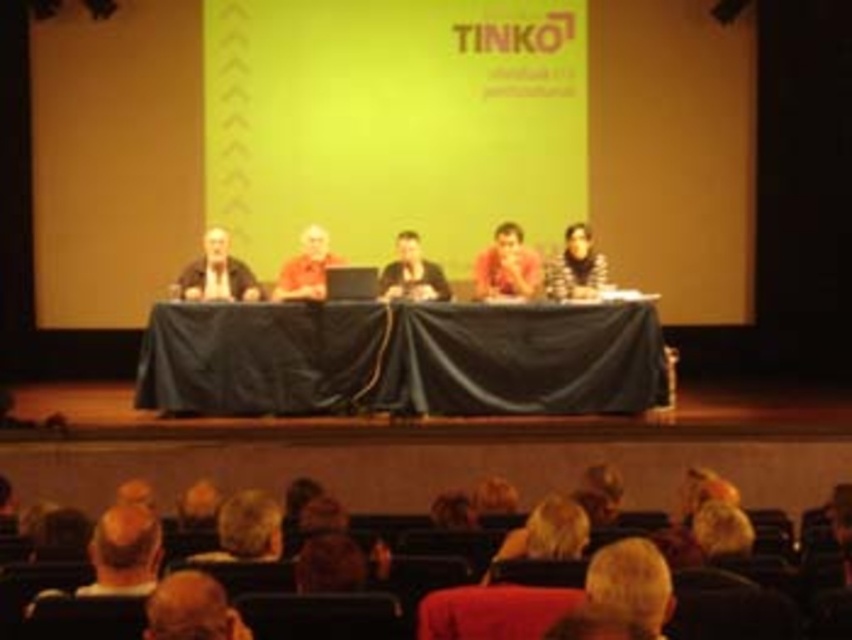
Question: Which object is farther from the camera taking this photo?

Choices:
 (A) matte black shirt at center
 (B) matte red shirt at center

Answer: (A)

Question: Which object is farther from the camera taking this photo?

Choices:
 (A) black clothed table at center
 (B) matte black suit at left
 (C) striped sweater at center
 (D) matte orange shirt at center

Answer: (C)

Question: Does matte red shirt at center appear under striped sweater at center?

Choices:
 (A) no
 (B) yes

Answer: (B)

Question: Does black clothed table at center lie in front of striped sweater at center?

Choices:
 (A) yes
 (B) no

Answer: (A)

Question: Can you confirm if matte black suit at left is smaller than striped sweater at center?

Choices:
 (A) no
 (B) yes

Answer: (A)

Question: Which of the following is the farthest from the observer?

Choices:
 (A) black clothed table at center
 (B) matte red shirt at center

Answer: (B)